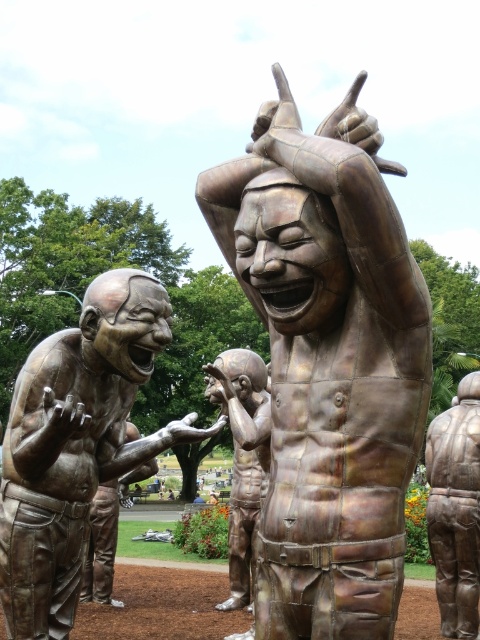
Question: Does bronze statue at center have a lesser width compared to bronze statue at right?

Choices:
 (A) yes
 (B) no

Answer: (B)

Question: Can you confirm if bronze statue at center is positioned below bronze statue at right?

Choices:
 (A) no
 (B) yes

Answer: (A)

Question: Can you confirm if bronze statue at center is smaller than bronze statue at right?

Choices:
 (A) yes
 (B) no

Answer: (B)

Question: Which of these objects is positioned farthest from the bronze/statue at left?

Choices:
 (A) bronze statue at right
 (B) bronze statue at center

Answer: (A)

Question: Among these objects, which one is nearest to the camera?

Choices:
 (A) bronze statue at right
 (B) bronze statue at center

Answer: (B)

Question: Considering the real-world distances, which object is farthest from the bronze/statue at left?

Choices:
 (A) bronze statue at right
 (B) bronze statue at center

Answer: (A)